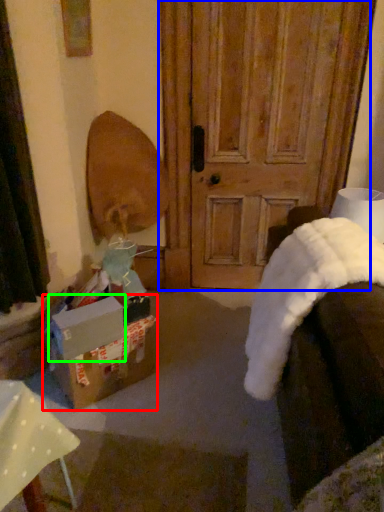
Question: Which object is the farthest from box (highlighted by a red box)? Choose among these: door (highlighted by a blue box) or cardboard box (highlighted by a green box).

Choices:
 (A) door
 (B) cardboard box

Answer: (A)